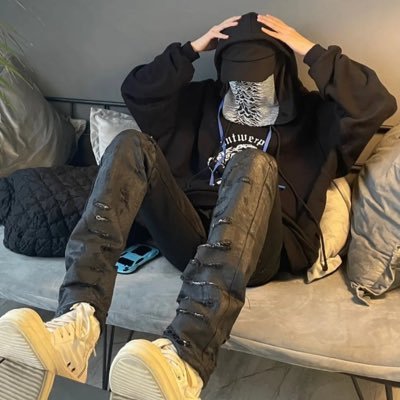
The image size is (400, 400). What are the coordinates of `pillow` in the screenshot? It's located at (382, 206), (333, 227), (102, 129), (41, 195), (18, 136).